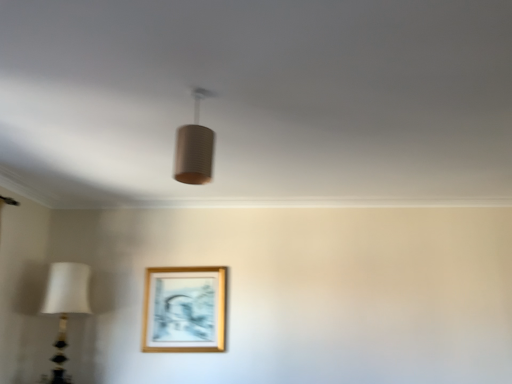
Question: Is white fabric lampshade at left, which is the 1th lamp in left-to-right order, at the right side of gold wooden picture frame at lower center?

Choices:
 (A) yes
 (B) no

Answer: (B)

Question: Does white fabric lampshade at left, the second lamp viewed from the top, turn towards gold wooden picture frame at lower center?

Choices:
 (A) no
 (B) yes

Answer: (B)

Question: Can you see white fabric lampshade at left, positioned as the first lamp in bottom-to-top order, touching gold wooden picture frame at lower center?

Choices:
 (A) no
 (B) yes

Answer: (A)

Question: From a real-world perspective, is white fabric lampshade at left, arranged as the 2th lamp when viewed from the front, on top of gold wooden picture frame at lower center?

Choices:
 (A) yes
 (B) no

Answer: (B)

Question: Considering the relative positions of white fabric lampshade at left, arranged as the 2th lamp when viewed from the front, and gold wooden picture frame at lower center in the image provided, is white fabric lampshade at left, arranged as the 2th lamp when viewed from the front, to the left of gold wooden picture frame at lower center from the viewer's perspective?

Choices:
 (A) no
 (B) yes

Answer: (B)

Question: Is white fabric lampshade at left, arranged as the 2th lamp when viewed from the front, shorter than gold wooden picture frame at lower center?

Choices:
 (A) yes
 (B) no

Answer: (B)

Question: Is matte brown cylinder at center, the second lamp when ordered from left to right, bigger than gold wooden picture frame at lower center?

Choices:
 (A) yes
 (B) no

Answer: (B)

Question: From a real-world perspective, is matte brown cylinder at center, acting as the 2th lamp starting from the bottom, positioned over gold wooden picture frame at lower center based on gravity?

Choices:
 (A) yes
 (B) no

Answer: (A)

Question: Is matte brown cylinder at center, positioned as the first lamp in top-to-bottom order, positioned with its back to gold wooden picture frame at lower center?

Choices:
 (A) no
 (B) yes

Answer: (A)

Question: Can you confirm if matte brown cylinder at center, positioned as the first lamp in top-to-bottom order, is smaller than gold wooden picture frame at lower center?

Choices:
 (A) yes
 (B) no

Answer: (A)

Question: Can you see matte brown cylinder at center, arranged as the first lamp when viewed from the front, touching gold wooden picture frame at lower center?

Choices:
 (A) yes
 (B) no

Answer: (B)

Question: From the image's perspective, is matte brown cylinder at center, positioned as the first lamp in top-to-bottom order, on top of gold wooden picture frame at lower center?

Choices:
 (A) yes
 (B) no

Answer: (A)

Question: Is the position of gold wooden picture frame at lower center less distant than that of matte brown cylinder at center, arranged as the first lamp when viewed from the front?

Choices:
 (A) yes
 (B) no

Answer: (B)